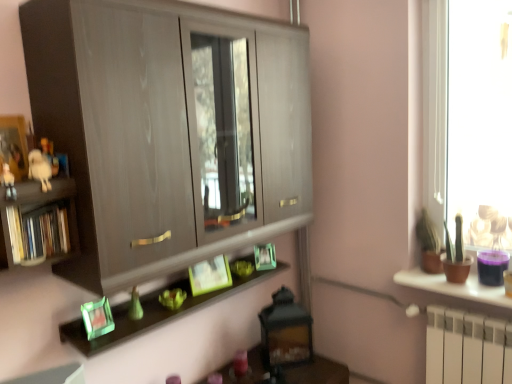
This screenshot has height=384, width=512. What do you see at coordinates (40, 169) in the screenshot?
I see `white plush toy at left` at bounding box center [40, 169].

In order to face white plush toy at left, should I rotate leftwards or rightwards?

To align with it, rotate left about 26.359°.

Describe the element at coordinates (429, 244) in the screenshot. I see `green matte plant at right, the 2th houseplant in the front-to-back sequence` at that location.

Describe the element at coordinates (456, 256) in the screenshot. I see `green matte cactus at right, the first houseplant viewed from the front` at that location.

In order to face white matte figurine at left, should I rotate leftwards or rightwards?

Turn left approximately 29.674 degrees to face it.

From the picture: In order to face green matte picture frame at center, the first picture frame viewed from the back, should I rotate leftwards or rightwards?

You should look right and rotate roughly 1.154 degrees.

Locate an element on the screen. The image size is (512, 384). matte wood cabinet at center is located at coordinates (168, 131).

Identify the location of white plush toy at left. The height and width of the screenshot is (384, 512). (40, 169).

In terms of height, does green matte plant at right, the 2th houseplant in the front-to-back sequence, look taller or shorter compared to wooden books at left?

Considering their sizes, green matte plant at right, the 2th houseplant in the front-to-back sequence, has more height than wooden books at left.

Is green matte plant at right, the 2th houseplant in the front-to-back sequence, bigger than wooden books at left?

Correct, green matte plant at right, the 2th houseplant in the front-to-back sequence, is larger in size than wooden books at left.

Is wooden books at left located within green matte plant at right, the first houseplant positioned from the back?

That's incorrect, wooden books at left is not inside green matte plant at right, the first houseplant positioned from the back.

Between green matte plant at right, the 2th houseplant in the front-to-back sequence, and wooden books at left, which one is positioned behind?

green matte plant at right, the 2th houseplant in the front-to-back sequence, is further from the camera.

Is green matte picture frame at center, which appears as the 2th picture frame when viewed from the back, oriented towards brown matte pot at right?

No, green matte picture frame at center, which appears as the 2th picture frame when viewed from the back, is not turned towards brown matte pot at right.

Can you confirm if green matte picture frame at center, which appears as the 2th picture frame when viewed from the back, is taller than brown matte pot at right?

Indeed, green matte picture frame at center, which appears as the 2th picture frame when viewed from the back, has a greater height compared to brown matte pot at right.

Where is `counter directly beneath the green matte picture frame at center, the 2th picture frame in the right-to-left sequence (from a real-world perspective)`? counter directly beneath the green matte picture frame at center, the 2th picture frame in the right-to-left sequence (from a real-world perspective) is located at coordinates (454, 287).

Is green matte picture frame at center, positioned as the second picture frame in left-to-right order, bigger than brown matte pot at right?

Incorrect, green matte picture frame at center, positioned as the second picture frame in left-to-right order, is not larger than brown matte pot at right.

Is the surface of matte wood cabinet at center in direct contact with green matte cactus at right, which is counted as the second houseplant, starting from the back?

No, matte wood cabinet at center is not next to green matte cactus at right, which is counted as the second houseplant, starting from the back.

Which is closer to the camera, (149,150) or (461,217)?

Point (149,150)

Considering the relative sizes of matte wood cabinet at center and green matte cactus at right, which is counted as the second houseplant, starting from the back, in the image provided, is matte wood cabinet at center wider than green matte cactus at right, which is counted as the second houseplant, starting from the back,?

Yes.

Identify the location of cabinetry lying on the left of green matte cactus at right, which is counted as the second houseplant, starting from the back. (168, 131).

Is the depth of matte wood cabinet at center greater than that of green matte picture frame at center, positioned as the second picture frame in left-to-right order?

No.

There is a matte wood cabinet at center. At what (x,y) coordinates should I click in order to perform the action: click on the 1st picture frame below it (from a real-world perspective). Please return your answer as a coordinate pair (x, y). Image resolution: width=512 pixels, height=384 pixels. Looking at the image, I should click on (210, 275).

Can you see matte wood cabinet at center touching green matte picture frame at center, the 2th picture frame in the right-to-left sequence?

No, matte wood cabinet at center is not making contact with green matte picture frame at center, the 2th picture frame in the right-to-left sequence.

How many degrees apart are the facing directions of matte wood cabinet at center and green matte plant at right, the 2th houseplant in the front-to-back sequence?

There is a 87.8-degree angle between the facing directions of matte wood cabinet at center and green matte plant at right, the 2th houseplant in the front-to-back sequence.

From the image's perspective, is matte wood cabinet at center above green matte plant at right, the 2th houseplant in the front-to-back sequence?

Correct, matte wood cabinet at center appears higher than green matte plant at right, the 2th houseplant in the front-to-back sequence, in the image.

Consider the image. Is matte wood cabinet at center taller than green matte plant at right, the 2th houseplant in the front-to-back sequence?

Indeed, matte wood cabinet at center has a greater height compared to green matte plant at right, the 2th houseplant in the front-to-back sequence.

Which object is closer to the camera taking this photo, matte wood cabinet at center or green matte plant at right, the 2th houseplant in the front-to-back sequence?

matte wood cabinet at center.

From the picture: Between wooden books at left and green glass picture frame at lower left, the first picture frame when ordered from left to right, which one has smaller width?

Thinner between the two is green glass picture frame at lower left, the first picture frame when ordered from left to right.

Looking at this image, would you say green glass picture frame at lower left, which is the 3th picture frame from back to front, is part of wooden books at left's contents?

No.

In the image, is wooden books at left positioned in front of or behind green glass picture frame at lower left, which is the 3th picture frame from back to front?

Clearly, wooden books at left is in front of green glass picture frame at lower left, which is the 3th picture frame from back to front.

Is wooden books at left not close to green glass picture frame at lower left, which is the 3th picture frame in right-to-left order?

wooden books at left is actually quite close to green glass picture frame at lower left, which is the 3th picture frame in right-to-left order.

Which object is wider, green glass picture frame at lower left, the first picture frame when ordered from left to right, or matte wood cabinet at center?

matte wood cabinet at center is wider.

Looking at this image, from a real-world perspective, is green glass picture frame at lower left, which is the 3th picture frame in right-to-left order, under matte wood cabinet at center?

Yes, from a real-world perspective, green glass picture frame at lower left, which is the 3th picture frame in right-to-left order, is below matte wood cabinet at center.

Considering the relative positions of green glass picture frame at lower left, which is the 3th picture frame in right-to-left order, and matte wood cabinet at center in the image provided, is green glass picture frame at lower left, which is the 3th picture frame in right-to-left order, to the left or to the right of matte wood cabinet at center?

From the image, it's evident that green glass picture frame at lower left, which is the 3th picture frame in right-to-left order, is to the left of matte wood cabinet at center.

Would you consider green glass picture frame at lower left, which ranks as the 1th picture frame in front-to-back order, to be distant from matte wood cabinet at center?

No, green glass picture frame at lower left, which ranks as the 1th picture frame in front-to-back order, is not far from matte wood cabinet at center.

What are the coordinates of `shelf on the left side of green matte plant at right, the 2th houseplant in the front-to-back sequence` in the screenshot? It's located at (38, 222).

The height and width of the screenshot is (384, 512). In order to click on counter below the green matte picture frame at center, positioned as the second picture frame in left-to-right order (from a real-world perspective) in this screenshot , I will do `click(454, 287)`.

Considering their positions, is white plush toy at left positioned closer to white matte figurine at left than wooden books at left?

Among the two, white plush toy at left is located nearer to white matte figurine at left.

Considering their positions, is white plush toy at left positioned closer to white matte figurine at left than green matte cactus at right, which is counted as the second houseplant, starting from the back?

white plush toy at left is closer to white matte figurine at left.

Looking at the image, which one is located further to matte wood cabinet at center, green matte picture frame at center, the 2th picture frame in the right-to-left sequence, or green glass picture frame at lower left, which ranks as the 1th picture frame in front-to-back order?

The object further to matte wood cabinet at center is green glass picture frame at lower left, which ranks as the 1th picture frame in front-to-back order.

From the image, which object appears to be nearer to brown matte pot at right, green matte plant at right, the 2th houseplant in the front-to-back sequence, or green matte picture frame at center, positioned as the second picture frame in left-to-right order?

green matte plant at right, the 2th houseplant in the front-to-back sequence, is positioned closer to the anchor brown matte pot at right.

Which object lies nearer to the anchor point green glass picture frame at lower left, which is the 3th picture frame in right-to-left order, green matte picture frame at center, the second picture frame from the front, or green matte picture frame at center, which is the 3th picture frame from left to right?

green matte picture frame at center, the second picture frame from the front, is positioned closer to the anchor green glass picture frame at lower left, which is the 3th picture frame in right-to-left order.

Which object lies nearer to the anchor point white plush toy at left, green matte plant at right, the first houseplant positioned from the back, or green matte cactus at right, the first houseplant viewed from the front?

green matte plant at right, the first houseplant positioned from the back.

Based on their spatial positions, is green matte cactus at right, which is counted as the second houseplant, starting from the back, or green matte picture frame at center, the first picture frame viewed from the back, further from matte wood cabinet at center?

green matte cactus at right, which is counted as the second houseplant, starting from the back, is positioned further to the anchor matte wood cabinet at center.

Estimate the real-world distances between objects in this image. Which object is closer to wooden books at left, green matte picture frame at center, the first picture frame viewed from the back, or green glass picture frame at lower left, which is the 3th picture frame in right-to-left order?

green glass picture frame at lower left, which is the 3th picture frame in right-to-left order, lies closer to wooden books at left than the other object.

The height and width of the screenshot is (384, 512). Identify the location of houseplant between green glass picture frame at lower left, which is the 3th picture frame in right-to-left order, and green matte cactus at right, which is counted as the second houseplant, starting from the back. (429, 244).

I want to click on toy between white plush toy at left and green glass picture frame at lower left, which ranks as the 1th picture frame in front-to-back order, from top to bottom, so click(x=9, y=183).

Locate an element on the screen. The image size is (512, 384). shelf between white matte figurine at left and green matte picture frame at center, the first picture frame from the right, from front to back is located at coordinates (38, 222).

This screenshot has width=512, height=384. I want to click on cabinetry between wooden books at left and green matte plant at right, the 2th houseplant in the front-to-back sequence, so click(x=168, y=131).